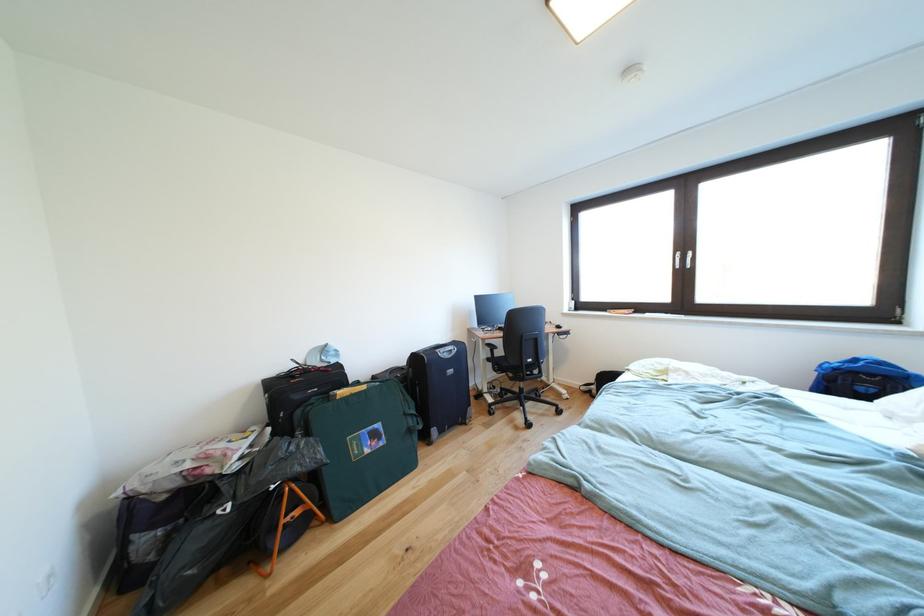
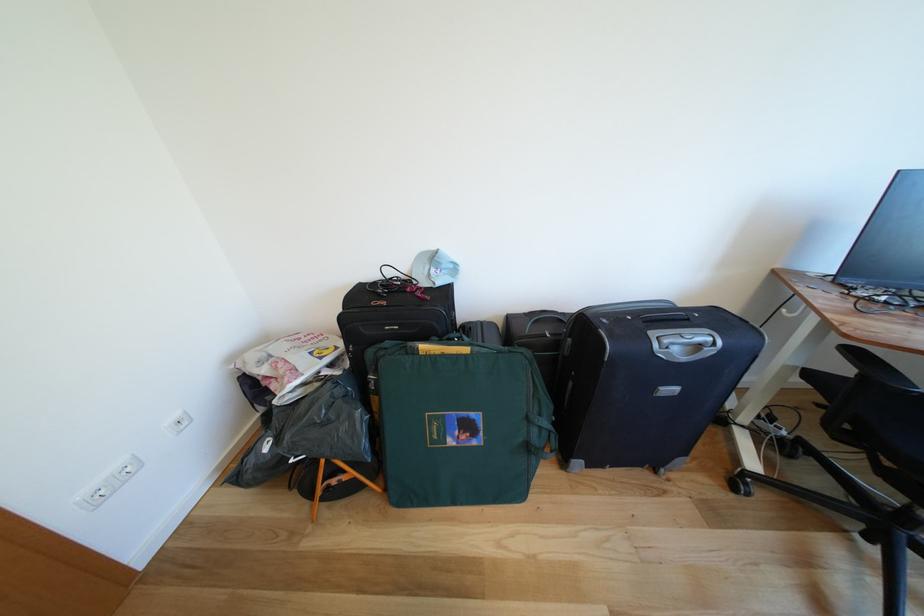
Where in the second image is the point corresponding to (458,355) from the first image?

(707, 351)